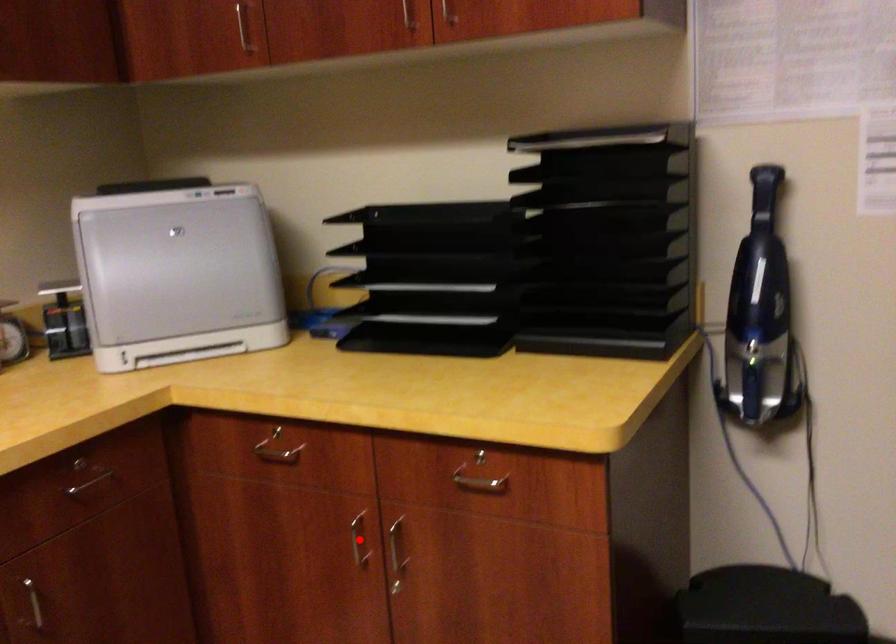
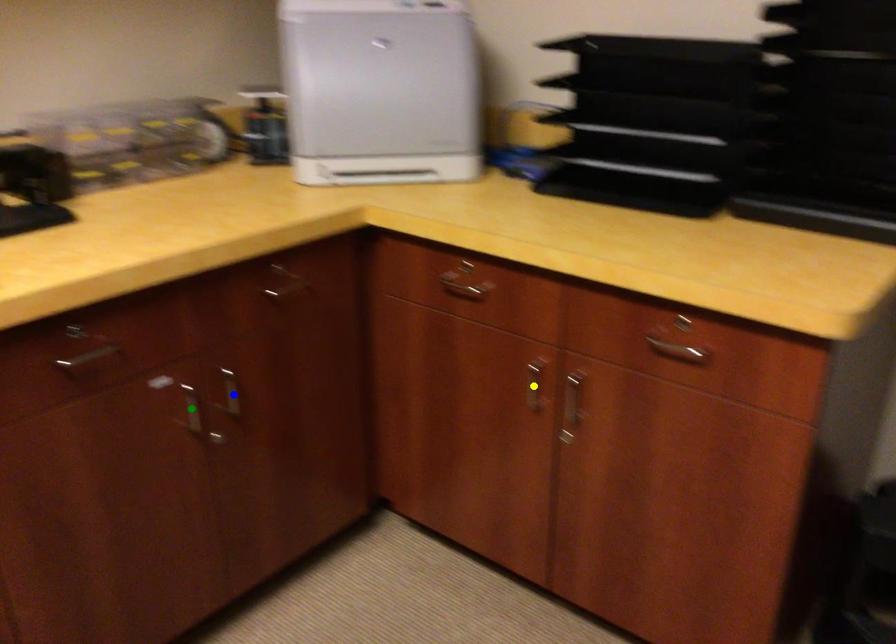
Question: I am providing you with two images of the same scene from different viewpoints. A red point is marked on the first image. You are given multiple points on the second image. Which point in image 2 is actually the same real-world point as the red point in image 1?

Choices:
 (A) blue point
 (B) yellow point
 (C) green point

Answer: (B)